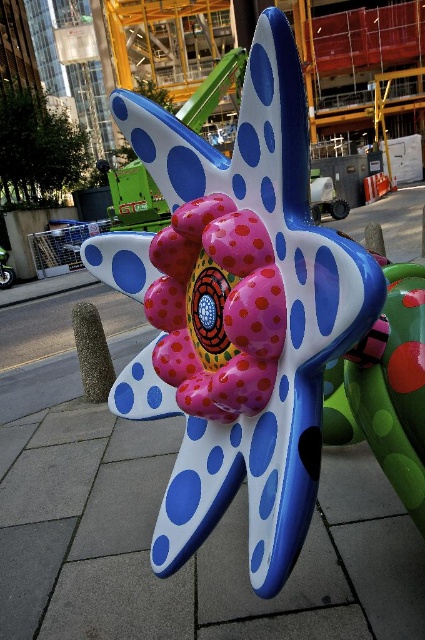
Question: Does glossy plastic starfish at center have a smaller size compared to pink glossy flower at center?

Choices:
 (A) yes
 (B) no

Answer: (B)

Question: Which point is farther to the camera?

Choices:
 (A) (246, 358)
 (B) (220, 285)

Answer: (B)

Question: In this image, where is glossy plastic starfish at center located relative to pink glossy flower at center?

Choices:
 (A) above
 (B) below

Answer: (B)

Question: Can you confirm if glossy plastic starfish at center is positioned above pink glossy flower at center?

Choices:
 (A) no
 (B) yes

Answer: (A)

Question: Among these objects, which one is nearest to the camera?

Choices:
 (A) pink glossy flower at center
 (B) glossy plastic starfish at center

Answer: (B)